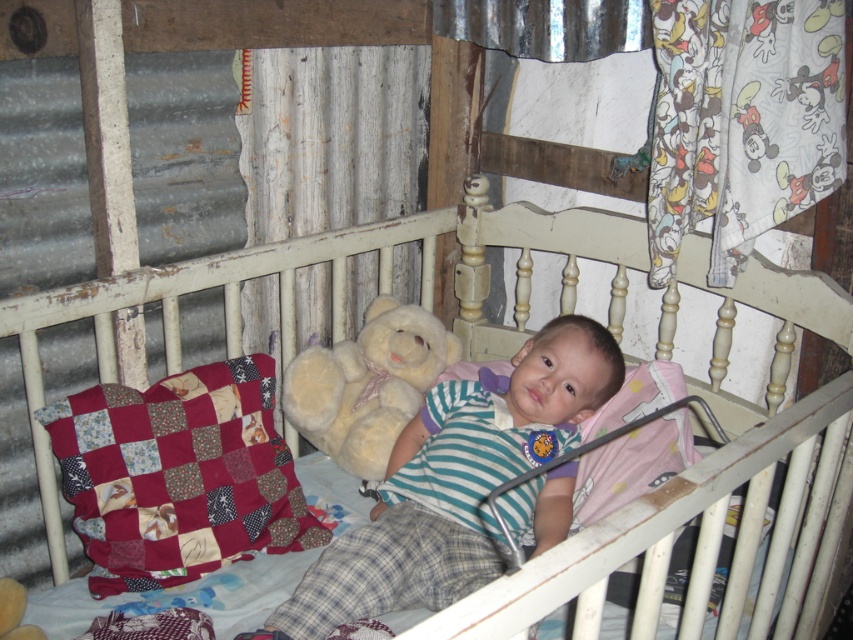
Question: Does soft beige teddy bear at center appear on the left side of patchwork fabric pillow at left?

Choices:
 (A) yes
 (B) no

Answer: (B)

Question: Is white wooden crib at center to the right of patchwork fabric pillow at left from the viewer's perspective?

Choices:
 (A) no
 (B) yes

Answer: (B)

Question: Does soft beige teddy bear at center appear on the right side of patchwork fabric pillow at left?

Choices:
 (A) no
 (B) yes

Answer: (B)

Question: Which of the following is the closest to the observer?

Choices:
 (A) (705, 468)
 (B) (466, 435)
 (C) (312, 360)
 (D) (287, 500)

Answer: (A)

Question: Which point is farther to the camera?

Choices:
 (A) patchwork fabric pillow at left
 (B) soft beige teddy bear at center
 (C) fluffy white teddy bear at center
 (D) white wooden crib at center

Answer: (C)

Question: Which of the following is the farthest from the observer?

Choices:
 (A) white wooden crib at center
 (B) patchwork fabric pillow at left
 (C) fluffy white teddy bear at center

Answer: (C)